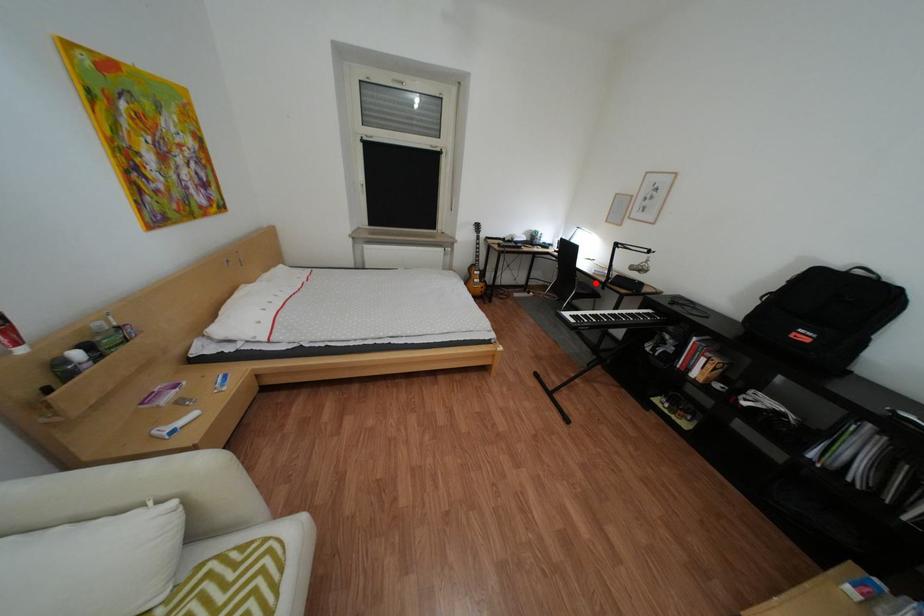
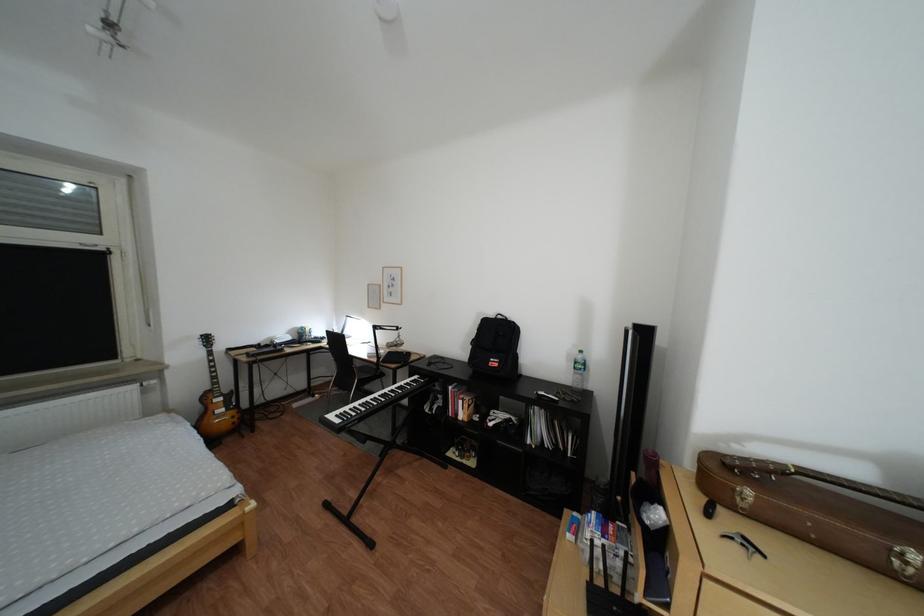
Question: I am providing you with two images of the same scene from different viewpoints. A red point is shown in image1. For the corresponding object point in image2, is it positioned nearer or farther from the camera?

Choices:
 (A) Nearer
 (B) Farther

Answer: (B)